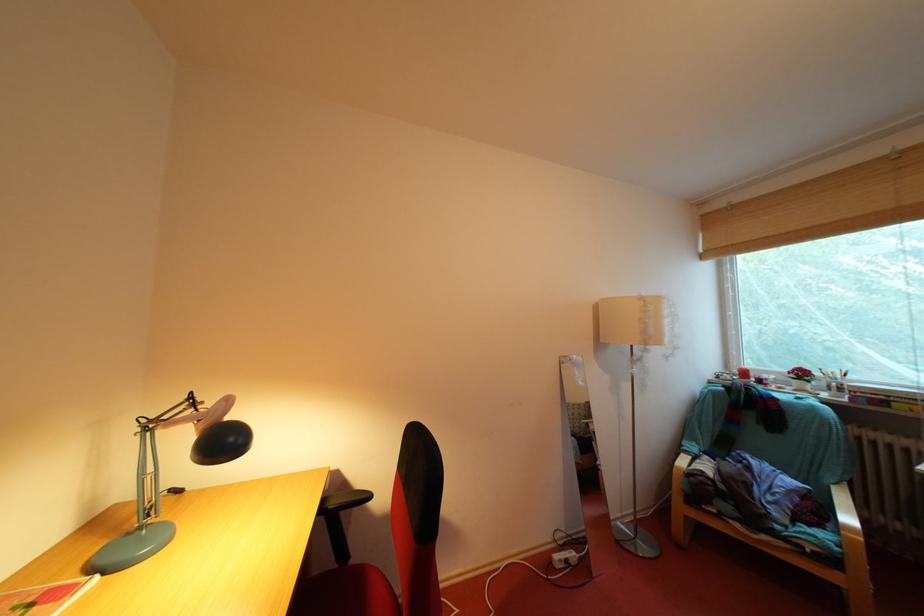
This screenshot has width=924, height=616. Describe the element at coordinates (222, 440) in the screenshot. I see `a desk lamp head` at that location.